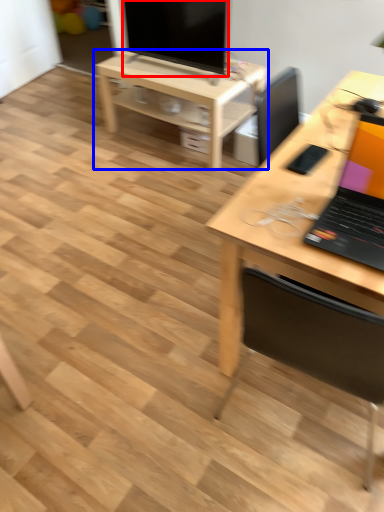
Question: Among these objects, which one is nearest to the camera, television (highlighted by a red box) or table (highlighted by a blue box)?

Choices:
 (A) television
 (B) table

Answer: (A)